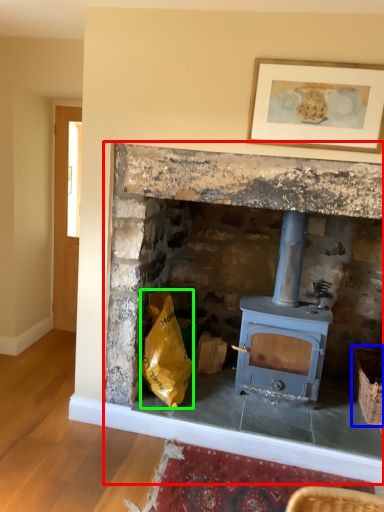
Question: Considering the real-world distances, which object is closest to fireplace (highlighted by a red box)? basket (highlighted by a blue box) or material (highlighted by a green box).

Choices:
 (A) basket
 (B) material

Answer: (B)